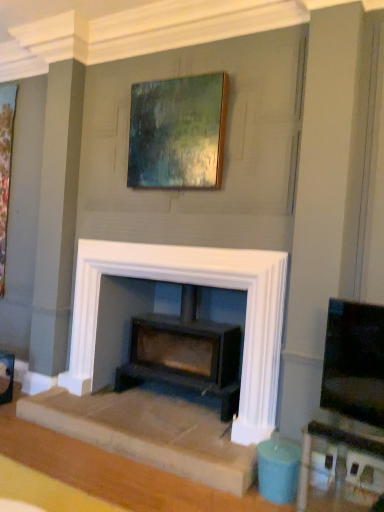
Question: From a real-world perspective, is wooden picture frame at left, which appears as the second picture frame when viewed from the front, beneath matte black wood burning stove at center?

Choices:
 (A) no
 (B) yes

Answer: (A)

Question: Does wooden picture frame at left, the first picture frame in the left-to-right sequence, have a greater width compared to matte black wood burning stove at center?

Choices:
 (A) yes
 (B) no

Answer: (B)

Question: Is wooden picture frame at left, which appears as the second picture frame when viewed from the front, beside matte black wood burning stove at center?

Choices:
 (A) no
 (B) yes

Answer: (A)

Question: Can you confirm if wooden picture frame at left, which appears as the first picture frame when viewed from the back, is positioned to the left of matte black wood burning stove at center?

Choices:
 (A) yes
 (B) no

Answer: (A)

Question: Does wooden picture frame at left, which appears as the first picture frame when viewed from the back, contain matte black wood burning stove at center?

Choices:
 (A) no
 (B) yes

Answer: (A)

Question: Is matte black tv at right taller or shorter than white stone fireplace at center?

Choices:
 (A) tall
 (B) short

Answer: (B)

Question: Considering the positions of matte black tv at right and white stone fireplace at center in the image, is matte black tv at right bigger or smaller than white stone fireplace at center?

Choices:
 (A) small
 (B) big

Answer: (A)

Question: Visually, is matte black tv at right positioned to the left or to the right of white stone fireplace at center?

Choices:
 (A) left
 (B) right

Answer: (B)

Question: Considering their positions, is matte black tv at right located in front of or behind white stone fireplace at center?

Choices:
 (A) front
 (B) behind

Answer: (A)

Question: Is white stone fireplace at center to the left or to the right of matte white table at lower right in the image?

Choices:
 (A) right
 (B) left

Answer: (B)

Question: Considering the positions of point (253, 460) and point (302, 430), is point (253, 460) closer or farther from the camera than point (302, 430)?

Choices:
 (A) farther
 (B) closer

Answer: (B)

Question: From a real-world perspective, is white stone fireplace at center physically located above or below matte white table at lower right?

Choices:
 (A) above
 (B) below

Answer: (A)

Question: From their relative heights in the image, would you say white stone fireplace at center is taller or shorter than matte white table at lower right?

Choices:
 (A) short
 (B) tall

Answer: (B)

Question: Is matte black tv at right wider or thinner than wooden frame at upper center, the 1th picture frame from the right?

Choices:
 (A) wide
 (B) thin

Answer: (A)

Question: Considering the positions of matte black tv at right and wooden frame at upper center, the 1th picture frame from the right, in the image, is matte black tv at right bigger or smaller than wooden frame at upper center, the 1th picture frame from the right,?

Choices:
 (A) big
 (B) small

Answer: (B)